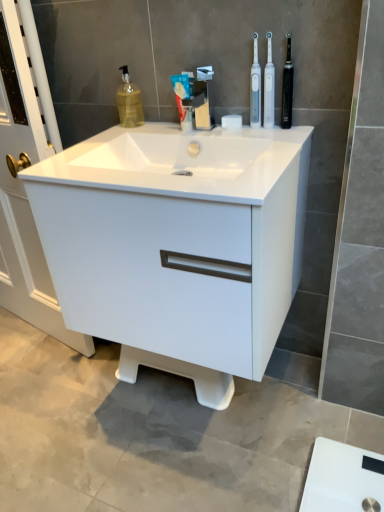
Question: Would you say white matte toothpaste at center is a long distance from white plastic toothbrush at upper right, which is counted as the first toothbrush, starting from the right?

Choices:
 (A) no
 (B) yes

Answer: (A)

Question: Considering the relative sizes of white matte toothpaste at center and white plastic toothbrush at upper right, which is counted as the first toothbrush, starting from the right, in the image provided, is white matte toothpaste at center shorter than white plastic toothbrush at upper right, which is counted as the first toothbrush, starting from the right,?

Choices:
 (A) no
 (B) yes

Answer: (B)

Question: Is white matte toothpaste at center with white plastic toothbrush at upper right, which is the 2th toothbrush in left-to-right order?

Choices:
 (A) no
 (B) yes

Answer: (A)

Question: Is white matte toothpaste at center looking in the opposite direction of white plastic toothbrush at upper right, which is counted as the first toothbrush, starting from the right?

Choices:
 (A) no
 (B) yes

Answer: (A)

Question: Can you confirm if white matte toothpaste at center is bigger than white plastic toothbrush at upper right, which is the 2th toothbrush in left-to-right order?

Choices:
 (A) no
 (B) yes

Answer: (B)

Question: Is point (203, 67) positioned closer to the camera than point (284, 106)?

Choices:
 (A) farther
 (B) closer

Answer: (A)

Question: From the image's perspective, relative to black rubber toothbrush at upper right, is satin nickel faucet at center above or below?

Choices:
 (A) above
 (B) below

Answer: (B)

Question: In terms of width, does satin nickel faucet at center look wider or thinner when compared to black rubber toothbrush at upper right?

Choices:
 (A) wide
 (B) thin

Answer: (A)

Question: Relative to black rubber toothbrush at upper right, is satin nickel faucet at center in front or behind?

Choices:
 (A) front
 (B) behind

Answer: (B)

Question: From a real-world perspective, is translucent yellow liquid at upper left above or below white plastic toothbrush at upper right, placed as the first toothbrush when sorted from left to right?

Choices:
 (A) above
 (B) below

Answer: (B)

Question: Looking at the image, does translucent yellow liquid at upper left seem bigger or smaller compared to white plastic toothbrush at upper right, placed as the first toothbrush when sorted from left to right?

Choices:
 (A) small
 (B) big

Answer: (B)

Question: Considering the relative positions of translucent yellow liquid at upper left and white plastic toothbrush at upper right, placed as the first toothbrush when sorted from left to right, in the image provided, is translucent yellow liquid at upper left to the left or to the right of white plastic toothbrush at upper right, placed as the first toothbrush when sorted from left to right,?

Choices:
 (A) right
 (B) left

Answer: (B)

Question: Relative to white plastic toothbrush at upper right, the second toothbrush positioned from the right, is translucent yellow liquid at upper left in front or behind?

Choices:
 (A) front
 (B) behind

Answer: (B)

Question: From their relative heights in the image, would you say black rubber toothbrush at upper right is taller or shorter than white glossy sink at center?

Choices:
 (A) tall
 (B) short

Answer: (A)

Question: From the image's perspective, is black rubber toothbrush at upper right located above or below white glossy sink at center?

Choices:
 (A) above
 (B) below

Answer: (A)